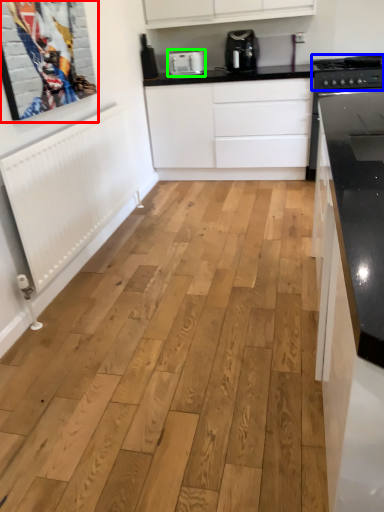
Question: Which object is the closest to the picture frame (highlighted by a red box)? Choose among these: stove (highlighted by a blue box) or kitchen appliance (highlighted by a green box).

Choices:
 (A) stove
 (B) kitchen appliance

Answer: (B)